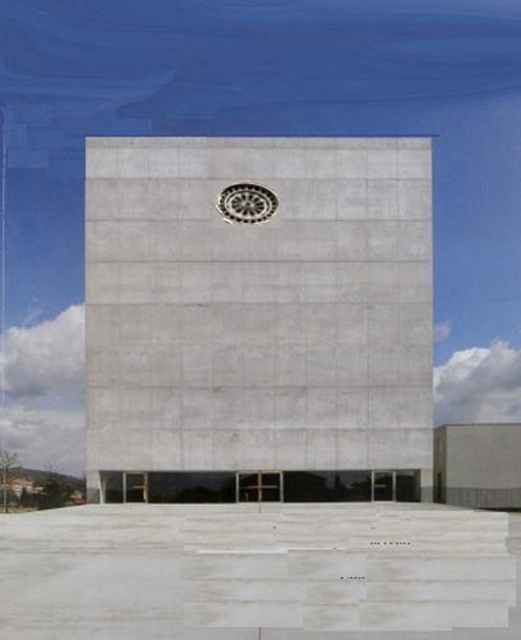
Question: Among these objects, which one is farthest from the camera?

Choices:
 (A) black metal clock at center
 (B) gray concrete tower at center

Answer: (A)

Question: Which object appears closest to the camera in this image?

Choices:
 (A) black metal clock at center
 (B) gray concrete tower at center

Answer: (B)

Question: Which point appears closest to the camera in this image?

Choices:
 (A) 237,280
 (B) 238,189

Answer: (A)

Question: Does gray concrete tower at center appear under black metal clock at center?

Choices:
 (A) yes
 (B) no

Answer: (A)

Question: Can you confirm if gray concrete tower at center is positioned to the left of black metal clock at center?

Choices:
 (A) no
 (B) yes

Answer: (A)

Question: Does gray concrete tower at center have a lesser width compared to black metal clock at center?

Choices:
 (A) no
 (B) yes

Answer: (A)